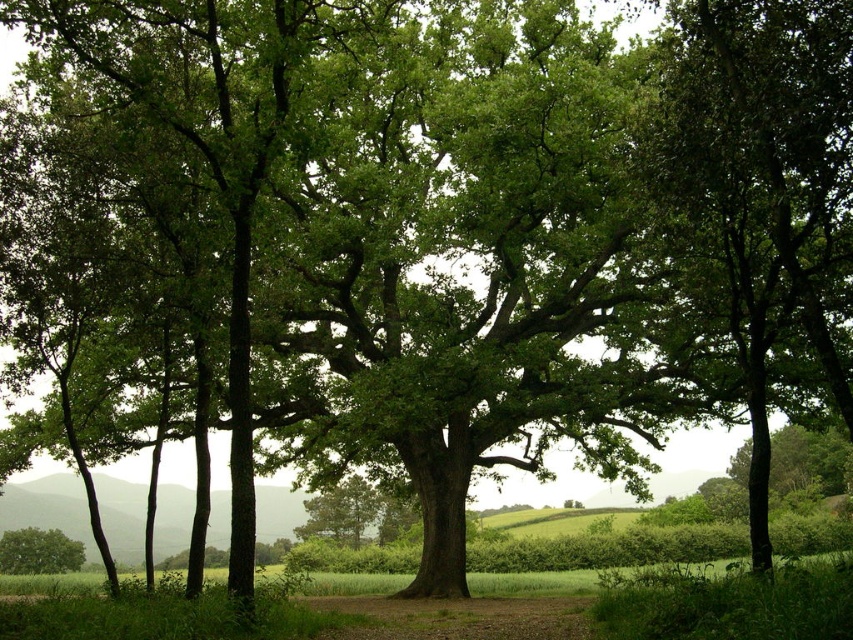
Question: Does green leafy tree at center have a greater width compared to green leafy tree at lower left?

Choices:
 (A) yes
 (B) no

Answer: (A)

Question: Is green leafy tree at center in front of green leafy tree at lower left?

Choices:
 (A) yes
 (B) no

Answer: (A)

Question: Is green leafy tree at center closer to the viewer compared to green leafy tree at lower left?

Choices:
 (A) no
 (B) yes

Answer: (B)